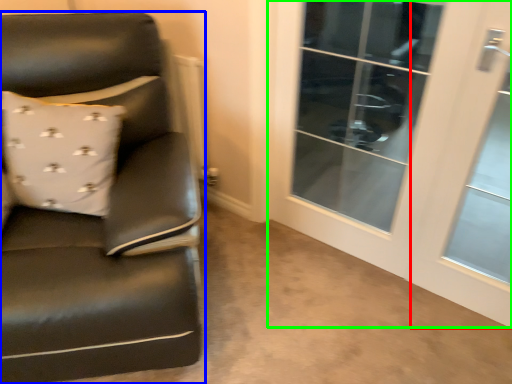
Question: Which is nearer to the screen door (highlighted by a red box)? chair (highlighted by a blue box) or screen door (highlighted by a green box).

Choices:
 (A) chair
 (B) screen door

Answer: (B)